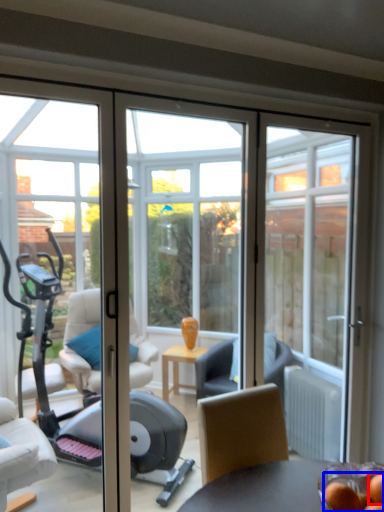
Question: Which point is further to the camera, food (highlighted by a red box) or food (highlighted by a blue box)?

Choices:
 (A) food
 (B) food

Answer: (A)